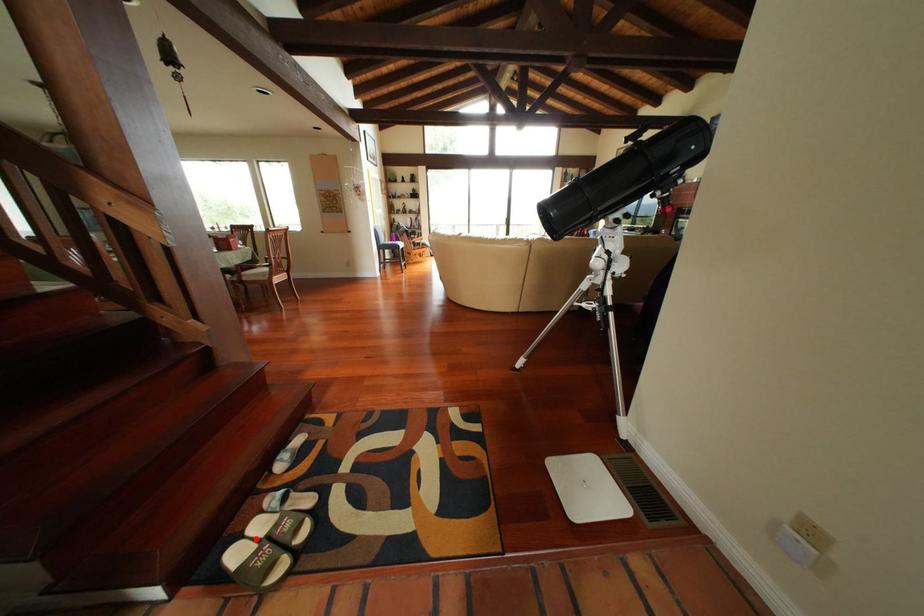
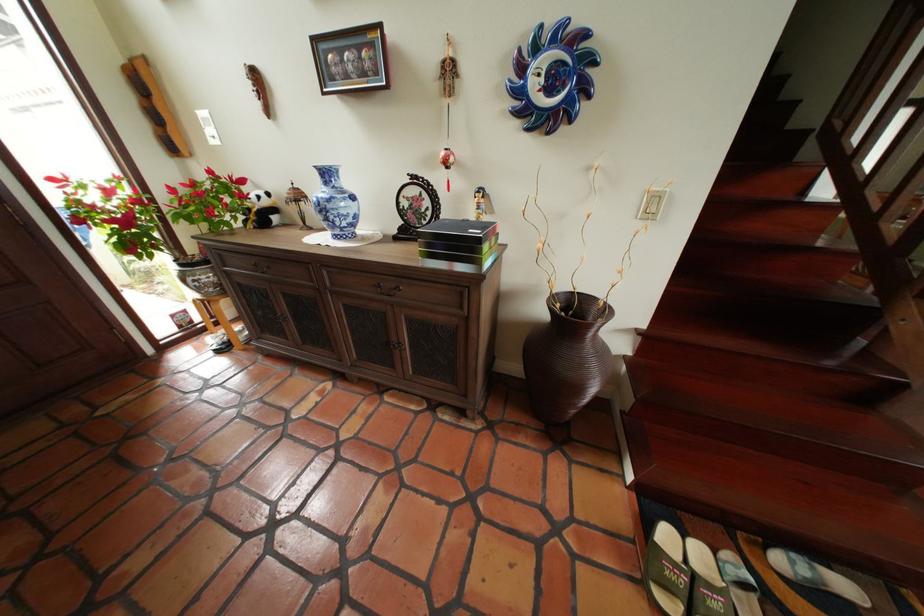
Find the pixel in the second image that matches the highlighted location in the first image.

(697, 539)